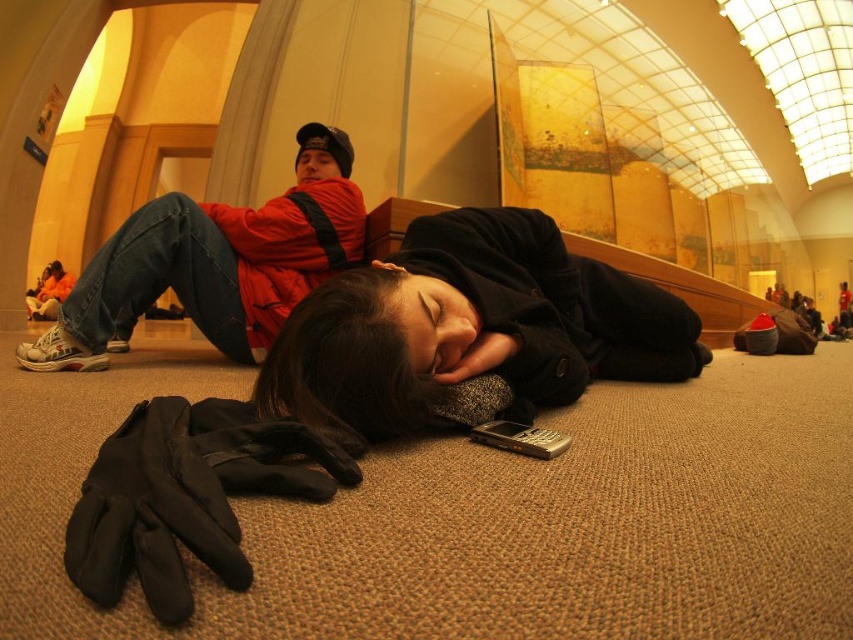
Does black woolen coat at center have a larger size compared to matte black cap at upper center?

Yes, black woolen coat at center is bigger than matte black cap at upper center.

Between point (343, 317) and point (326, 148), which one is positioned in front?

Point (343, 317)

Does point (582, 342) come farther from viewer compared to point (334, 132)?

No.

Where is `black woolen coat at center`? black woolen coat at center is located at coordinates (469, 326).

Can you confirm if red fleece jacket at upper left is positioned to the left of black fuzzy head at center?

A: Correct, you'll find red fleece jacket at upper left to the left of black fuzzy head at center.

Where is `red fleece jacket at upper left`? This screenshot has width=853, height=640. red fleece jacket at upper left is located at coordinates (213, 262).

How much distance is there between red fleece jacket at upper left and silver metallic phone at lower center?

red fleece jacket at upper left is 3.89 feet away from silver metallic phone at lower center.

Consider the image. Is red fleece jacket at upper left behind silver metallic phone at lower center?

Yes, it is.

Measure the distance between point (273,266) and camera.

5.98 feet

The height and width of the screenshot is (640, 853). I want to click on red fleece jacket at upper left, so click(213, 262).